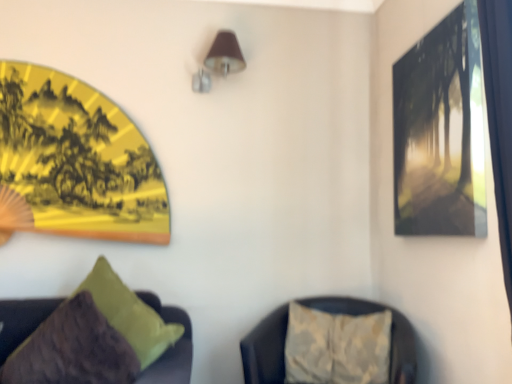
Question: Is textured beige cushion at lower right, the 1th furniture positioned from the right, smaller than matte black picture frame at upper right, which is counted as the second picture frame, starting from the back?

Choices:
 (A) no
 (B) yes

Answer: (A)

Question: Is textured beige cushion at lower right, marked as the 2th furniture in a left-to-right arrangement, wider than matte black picture frame at upper right, positioned as the 1th picture frame in front-to-back order?

Choices:
 (A) yes
 (B) no

Answer: (A)

Question: Considering the relative sizes of textured beige cushion at lower right, the 1th furniture positioned from the right, and matte black picture frame at upper right, the first picture frame viewed from the right, in the image provided, is textured beige cushion at lower right, the 1th furniture positioned from the right, shorter than matte black picture frame at upper right, the first picture frame viewed from the right,?

Choices:
 (A) no
 (B) yes

Answer: (B)

Question: Can you confirm if textured beige cushion at lower right, the 1th furniture positioned from the right, is thinner than matte black picture frame at upper right, positioned as the 1th picture frame in front-to-back order?

Choices:
 (A) yes
 (B) no

Answer: (B)

Question: From the image's perspective, is textured beige cushion at lower right, the 1th furniture positioned from the right, located beneath matte black picture frame at upper right, the first picture frame viewed from the right?

Choices:
 (A) yes
 (B) no

Answer: (A)

Question: Is point (219, 39) closer or farther from the camera than point (73, 195)?

Choices:
 (A) closer
 (B) farther

Answer: (B)

Question: Relative to yellow paper fan at upper left, acting as the 1th picture frame starting from the left, is brown fabric lampshade at upper center in front or behind?

Choices:
 (A) behind
 (B) front

Answer: (A)

Question: From the image's perspective, is brown fabric lampshade at upper center located above or below yellow paper fan at upper left, which appears as the first picture frame when viewed from the back?

Choices:
 (A) below
 (B) above

Answer: (B)

Question: Considering the positions of brown fabric lampshade at upper center and yellow paper fan at upper left, acting as the second picture frame starting from the front, in the image, is brown fabric lampshade at upper center wider or thinner than yellow paper fan at upper left, acting as the second picture frame starting from the front,?

Choices:
 (A) wide
 (B) thin

Answer: (A)

Question: Do you think yellow paper fan at upper left, acting as the 1th picture frame starting from the left, is within matte black picture frame at upper right, the first picture frame viewed from the right, or outside of it?

Choices:
 (A) outside
 (B) inside

Answer: (A)

Question: From the image's perspective, is yellow paper fan at upper left, acting as the 1th picture frame starting from the left, located above or below matte black picture frame at upper right, positioned as the 2th picture frame in left-to-right order?

Choices:
 (A) below
 (B) above

Answer: (A)

Question: Is point (47, 119) positioned closer to the camera than point (481, 203)?

Choices:
 (A) closer
 (B) farther

Answer: (B)

Question: Is yellow paper fan at upper left, which appears as the first picture frame when viewed from the back, to the left or to the right of matte black picture frame at upper right, positioned as the 1th picture frame in front-to-back order, in the image?

Choices:
 (A) left
 (B) right

Answer: (A)

Question: From a real-world perspective, is velvet green pillow at lower left, which is the 1th furniture in left-to-right order, physically located above or below yellow paper fan at upper left, which appears as the first picture frame when viewed from the back?

Choices:
 (A) below
 (B) above

Answer: (A)

Question: Is velvet green pillow at lower left, the second furniture when ordered from right to left, inside or outside of yellow paper fan at upper left, acting as the 1th picture frame starting from the left?

Choices:
 (A) outside
 (B) inside

Answer: (A)